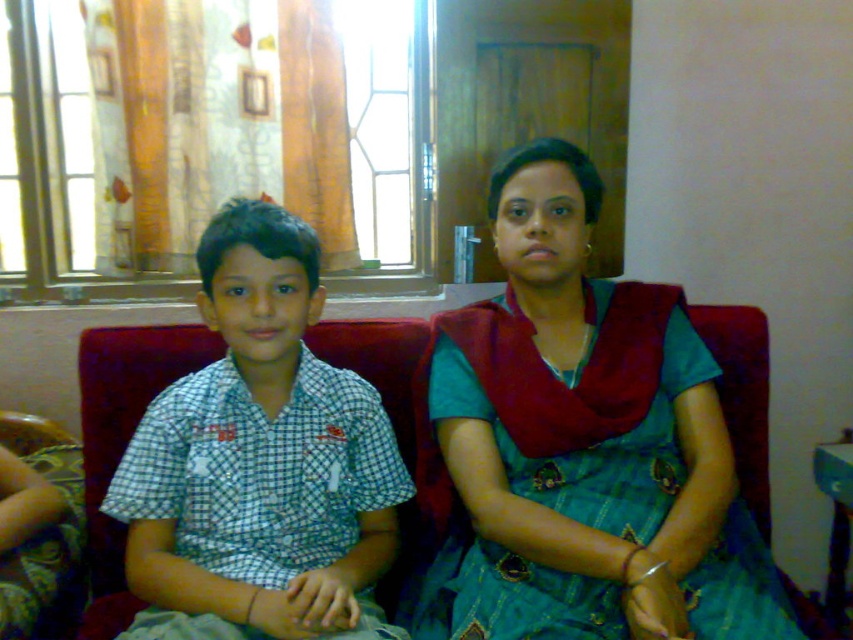
Based on the photo, what are the coordinates of the checkered fabric shirt at left?

The checkered fabric shirt at left is located at point (260, 461).

You are a tailor who needs to determine which fabric piece is more suitable for making a large tablecloth. Based on the image, which one between the teal silk saree at center and the checkered fabric shirt at left would you choose?

The teal silk saree at center is bigger than the checkered fabric shirt at left, so it would be more suitable for making a large tablecloth.

You are standing in the room where the two people are sitting on the red sofa. You want to place a small plant between the two points marked as point (x=462, y=461) and point (x=186, y=483). Which point should the plant be closer to so it appears closer to you?

The plant should be placed closer to point (x=462, y=461) because it is further to the viewer than point (x=186, y=483).